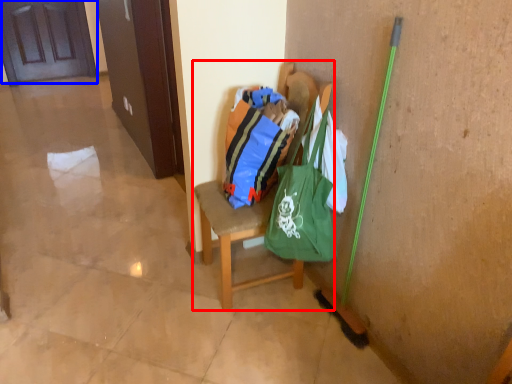
Question: Which object appears closest to the camera in this image, chair (highlighted by a red box) or door (highlighted by a blue box)?

Choices:
 (A) chair
 (B) door

Answer: (A)